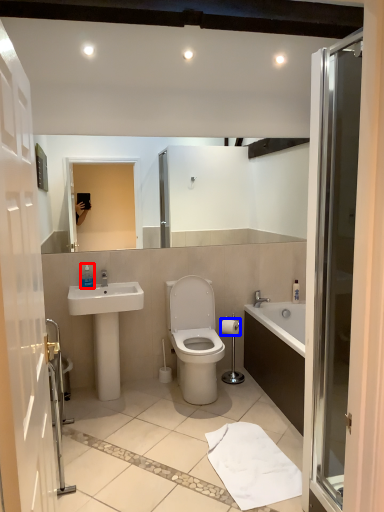
Question: Which point is closer to the camera, toiletry (highlighted by a red box) or toilet paper (highlighted by a blue box)?

Choices:
 (A) toiletry
 (B) toilet paper

Answer: (A)